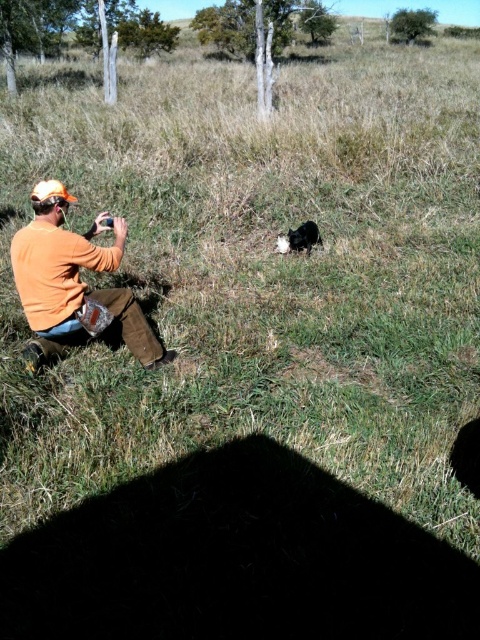
Can you confirm if orange cotton shirt at left is bigger than black fur dog at center?

Indeed, orange cotton shirt at left has a larger size compared to black fur dog at center.

Between orange cotton shirt at left and black fur dog at center, which one is positioned higher?

black fur dog at center is higher up.

Which is in front, point (122, 291) or point (290, 236)?

Point (122, 291) is in front.

I want to click on orange cotton shirt at left, so click(73, 282).